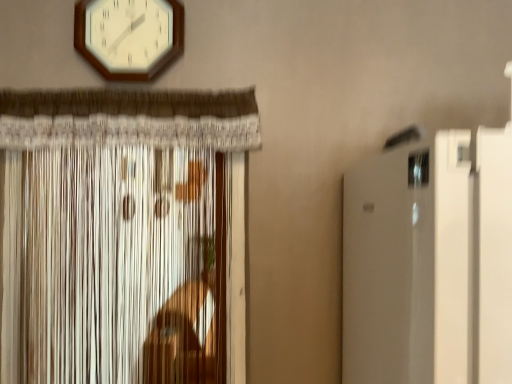
Question: From the image's perspective, is white wooden wall clock at upper center below white textured curtain at left?

Choices:
 (A) yes
 (B) no

Answer: (B)

Question: Can you confirm if white wooden wall clock at upper center is taller than white textured curtain at left?

Choices:
 (A) no
 (B) yes

Answer: (A)

Question: Is white wooden wall clock at upper center oriented towards white textured curtain at left?

Choices:
 (A) no
 (B) yes

Answer: (A)

Question: Is white wooden wall clock at upper center far from white textured curtain at left?

Choices:
 (A) no
 (B) yes

Answer: (A)

Question: Is white wooden wall clock at upper center to the right of white textured curtain at left from the viewer's perspective?

Choices:
 (A) yes
 (B) no

Answer: (A)

Question: Does white wooden wall clock at upper center come in front of white textured curtain at left?

Choices:
 (A) no
 (B) yes

Answer: (A)

Question: From the image's perspective, is white textured curtain at left above white wooden wall clock at upper center?

Choices:
 (A) yes
 (B) no

Answer: (B)

Question: Is white textured curtain at left in front of white wooden wall clock at upper center?

Choices:
 (A) yes
 (B) no

Answer: (A)

Question: Is white wooden wall clock at upper center inside white textured curtain at left?

Choices:
 (A) yes
 (B) no

Answer: (B)

Question: From the image's perspective, is white textured curtain at left below white wooden wall clock at upper center?

Choices:
 (A) no
 (B) yes

Answer: (B)

Question: Can you confirm if white textured curtain at left is bigger than white wooden wall clock at upper center?

Choices:
 (A) yes
 (B) no

Answer: (A)

Question: Is white textured curtain at left turned away from white wooden wall clock at upper center?

Choices:
 (A) no
 (B) yes

Answer: (A)

Question: Do you think white wooden wall clock at upper center is within white textured curtain at left, or outside of it?

Choices:
 (A) inside
 (B) outside

Answer: (B)